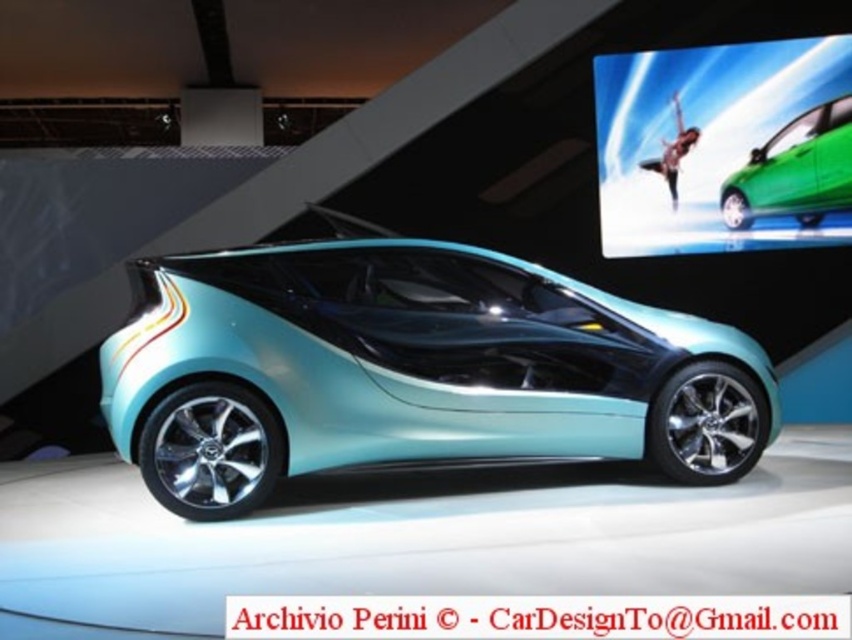
Question: Does metallic teal car at center lie behind green glossy car at center?

Choices:
 (A) no
 (B) yes

Answer: (A)

Question: Which of the following is the closest to the observer?

Choices:
 (A) (235, 282)
 (B) (850, 198)

Answer: (A)

Question: Can you confirm if metallic teal car at center is positioned to the left of green glossy car at center?

Choices:
 (A) yes
 (B) no

Answer: (A)

Question: Does metallic teal car at center appear under green glossy car at center?

Choices:
 (A) no
 (B) yes

Answer: (B)

Question: Which point is closer to the camera?

Choices:
 (A) (750, 422)
 (B) (832, 170)

Answer: (A)